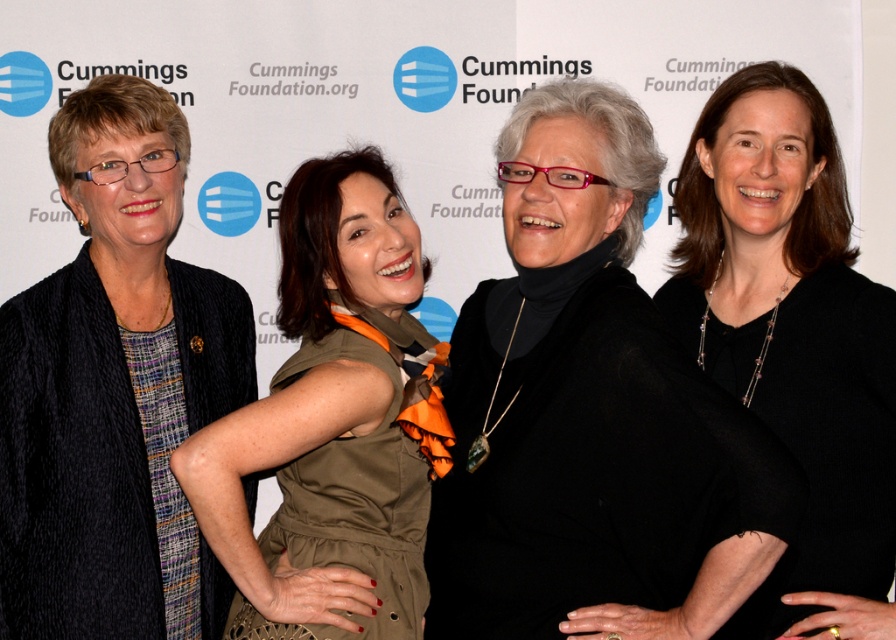
You are a photographer at the Cummings Foundation event. You need to arrange the two women wearing black matte sweater at center and matte black cardigan at left in a line for a group photo. Which one should stand to the left of the other to match their current positions?

The matte black cardigan at left should stand to the left of the black matte sweater at center because the black matte sweater at center is positioned on the right side of the matte black cardigan at left in their current arrangement.

You are at the Cummings Foundation event and need to locate the matte black cardigan at left. According to the coordinates provided, where exactly is it positioned?

The matte black cardigan at left is positioned at coordinates point (114, 388).